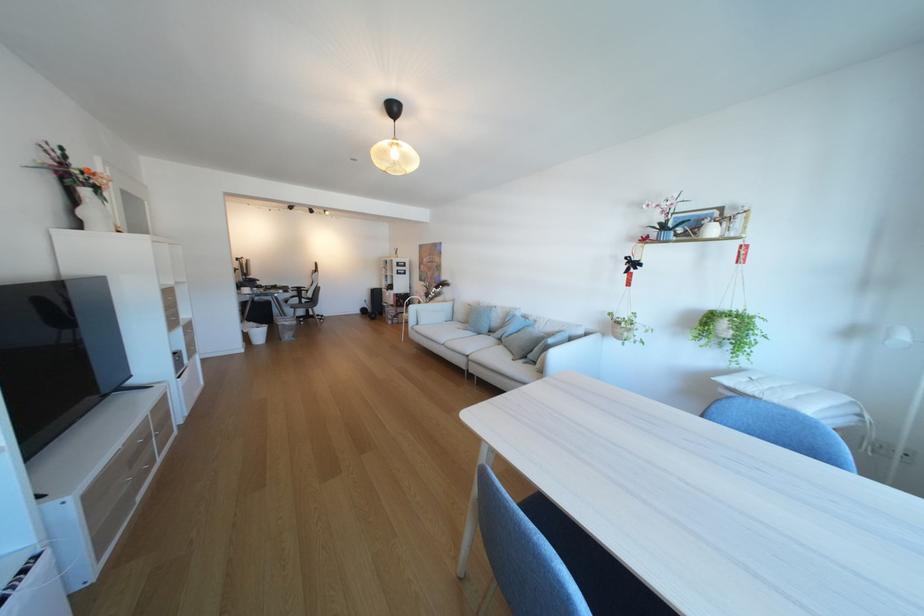
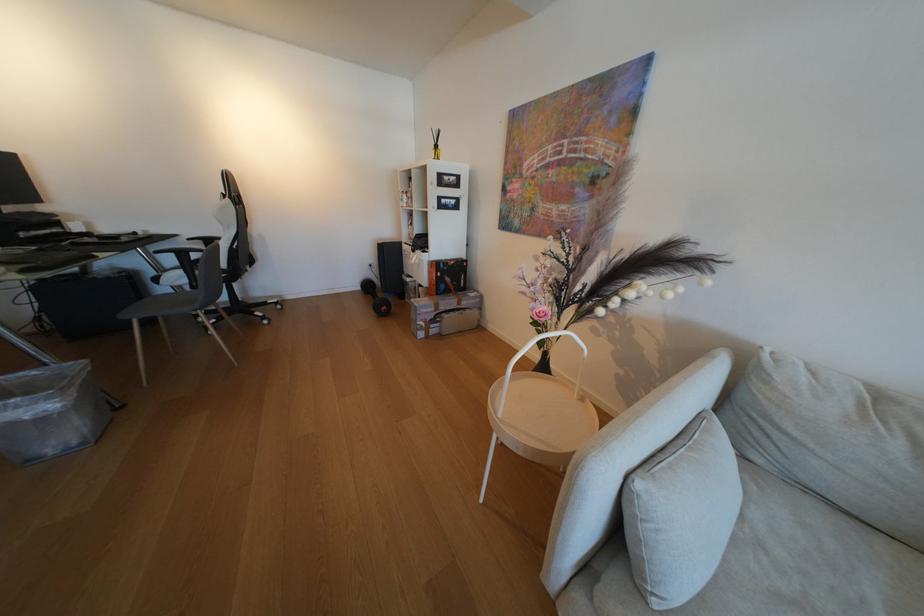
Find the pixel in the second image that matches (407,317) in the first image.

(444, 322)